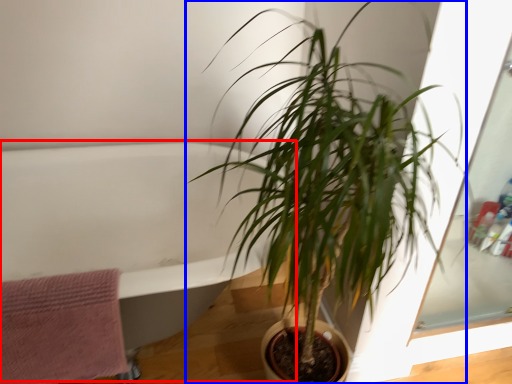
Question: Which object is closer to the camera taking this photo, bath (highlighted by a red box) or houseplant (highlighted by a blue box)?

Choices:
 (A) bath
 (B) houseplant

Answer: (B)